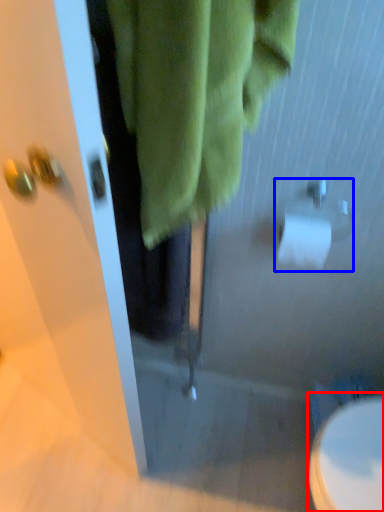
Question: Which object is closer to the camera taking this photo, toilet (highlighted by a red box) or toilet paper (highlighted by a blue box)?

Choices:
 (A) toilet
 (B) toilet paper

Answer: (B)